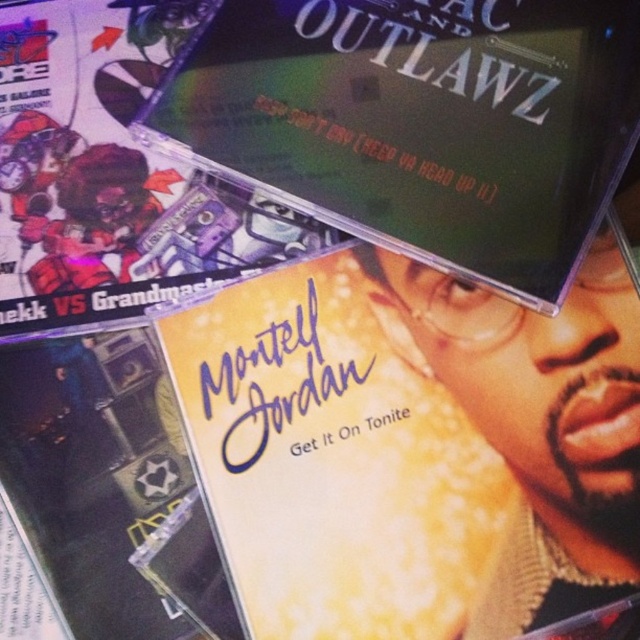
You are looking at the CD cases displayed in the image. Which of the two points, point [339,118] or point [145,33], is closer to you?

Point [339,118] is closer to the viewer than point [145,33].